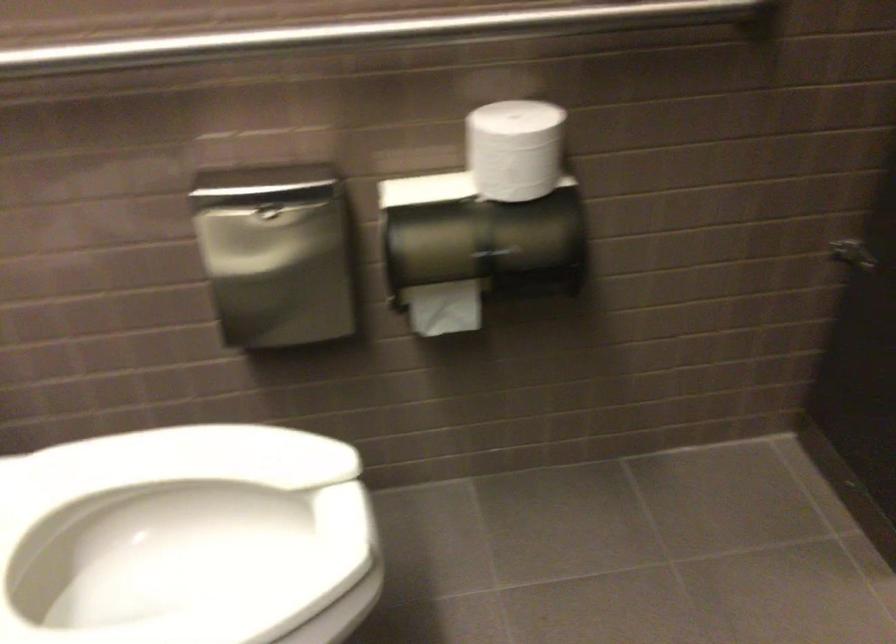
Where would you lift the white toilet paper roll? Please return your answer as a coordinate pair (x, y).

(514, 149)